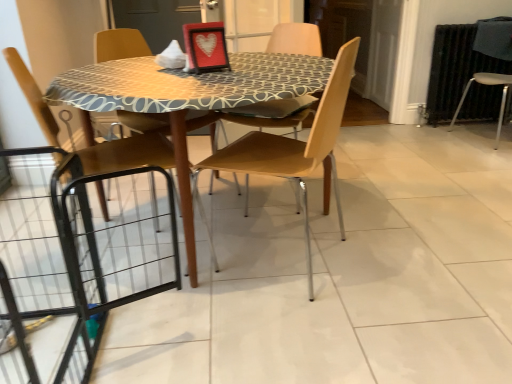
Question: Considering the relative sizes of wooden chair at left, which is the 3th chair in right-to-left order, and matte black picture frame at center in the image provided, is wooden chair at left, which is the 3th chair in right-to-left order, smaller than matte black picture frame at center?

Choices:
 (A) yes
 (B) no

Answer: (B)

Question: Is matte black picture frame at center inside wooden chair at left, marked as the first chair in a left-to-right arrangement?

Choices:
 (A) no
 (B) yes

Answer: (A)

Question: Is wooden chair at left, marked as the first chair in a left-to-right arrangement, behind matte black picture frame at center?

Choices:
 (A) yes
 (B) no

Answer: (B)

Question: From a real-world perspective, is wooden chair at left, which is the 3th chair in right-to-left order, under matte black picture frame at center?

Choices:
 (A) no
 (B) yes

Answer: (B)

Question: Does wooden chair at left, marked as the first chair in a left-to-right arrangement, have a greater width compared to matte black picture frame at center?

Choices:
 (A) yes
 (B) no

Answer: (A)

Question: Is wooden chair at left, marked as the first chair in a left-to-right arrangement, bigger than matte black picture frame at center?

Choices:
 (A) no
 (B) yes

Answer: (B)

Question: Does wooden chair at center, the second chair positioned from the left, have a lesser width compared to matte black picture frame at center?

Choices:
 (A) no
 (B) yes

Answer: (A)

Question: Is the position of wooden chair at center, the 2th chair positioned from the right, less distant than that of matte black picture frame at center?

Choices:
 (A) no
 (B) yes

Answer: (B)

Question: Is matte black picture frame at center a part of wooden chair at center, the 2th chair positioned from the right?

Choices:
 (A) no
 (B) yes

Answer: (A)

Question: Is the depth of wooden chair at center, the second chair positioned from the left, greater than that of matte black picture frame at center?

Choices:
 (A) no
 (B) yes

Answer: (A)

Question: Does wooden chair at center, the second chair positioned from the left, turn towards matte black picture frame at center?

Choices:
 (A) yes
 (B) no

Answer: (A)

Question: Considering the relative sizes of wooden chair at center, the second chair positioned from the left, and matte black picture frame at center in the image provided, is wooden chair at center, the second chair positioned from the left, wider than matte black picture frame at center?

Choices:
 (A) no
 (B) yes

Answer: (B)

Question: Can you see transparent glass screen door at center touching black metal radiator at right?

Choices:
 (A) yes
 (B) no

Answer: (B)